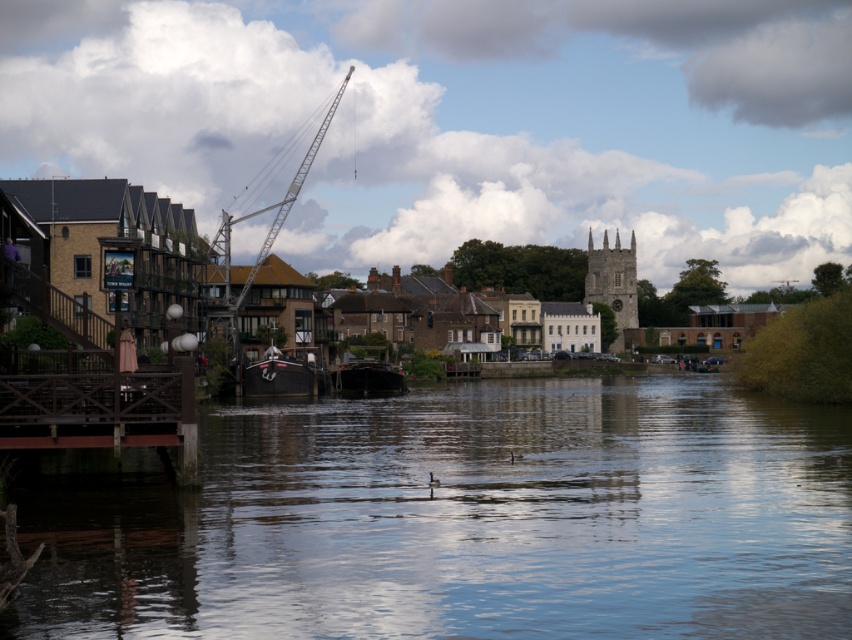
You are standing on the riverside and want to take a photo of the transparent water at center and the metallic gray boat at center. Which object will appear larger in your photo?

The transparent water at center will appear larger in the photo because it is closer to the viewer than the metallic gray boat at center.

You are standing at the riverside and want to take a photo of the metallic gray crane at upper left. If your camera has a maximum zoom range of 100 meters, will you be able to capture the crane clearly?

The metallic gray crane at upper left is 130.18 meters away from the viewer. Since the camera can only zoom up to 100 meters, you won generated question and answer based on the provided information. 130.18 is beyond the camera s capability. You need a camera with a longer zoom range to capture it clearly.